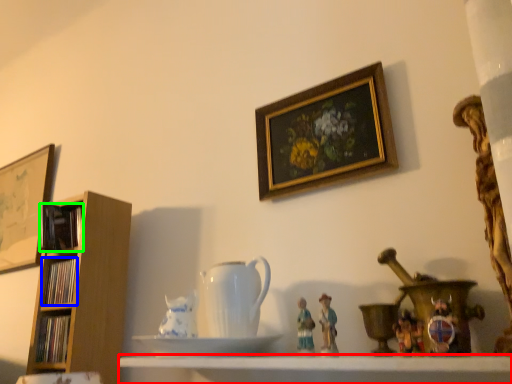
Question: Which is nearer to the shelf (highlighted by a red box)? book (highlighted by a blue box) or book (highlighted by a green box).

Choices:
 (A) book
 (B) book

Answer: (A)